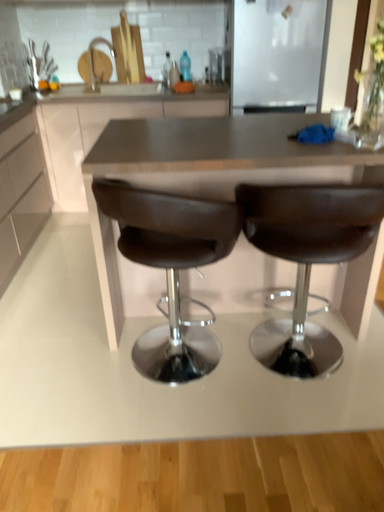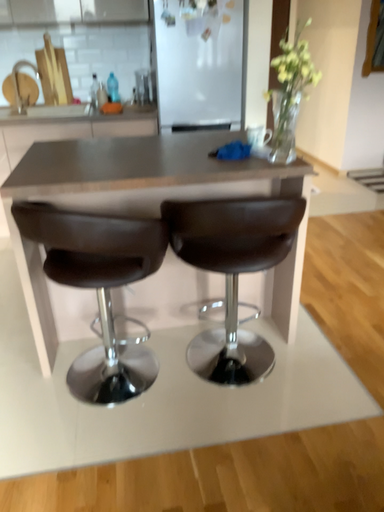
Question: How did the camera likely rotate when shooting the video?

Choices:
 (A) rotated right
 (B) rotated left

Answer: (A)